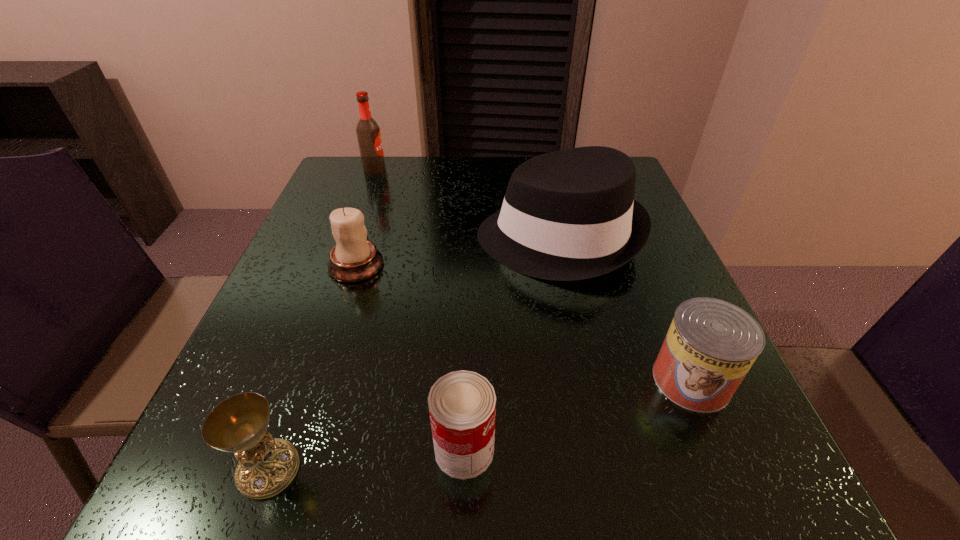
I want to click on fedora at the right edge, so click(567, 215).

Where is `can that is at the right edge`? The image size is (960, 540). can that is at the right edge is located at coordinates (711, 344).

Identify the location of object present at the far left corner. (368, 133).

This screenshot has width=960, height=540. I want to click on object at the near left corner, so click(267, 465).

The image size is (960, 540). What are the coordinates of `object positioned at the far right corner` in the screenshot? It's located at (567, 215).

In the image, there is a desktop. Where is `vacant space at the far edge`? vacant space at the far edge is located at coordinates (400, 165).

You are a GUI agent. You are given a task and a screenshot of the screen. Output one action in this format:
    pyautogui.click(x=<x>, y=<y>)
    Task: Click on the vacant space at the near edge of the desktop
    
    Given the screenshot: What is the action you would take?
    pyautogui.click(x=431, y=481)

The height and width of the screenshot is (540, 960). I want to click on vacant area at the left edge of the desktop, so click(294, 335).

Where is `vacant region at the right edge of the desktop`? Image resolution: width=960 pixels, height=540 pixels. vacant region at the right edge of the desktop is located at coordinates (646, 303).

Where is `vacant region at the far left corner of the desktop`? vacant region at the far left corner of the desktop is located at coordinates (379, 181).